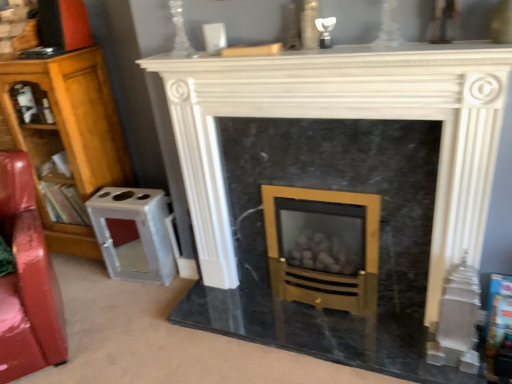
Question: Can you confirm if glossy red swivel chair at left is positioned to the left of wooden bookcase at left?

Choices:
 (A) no
 (B) yes

Answer: (A)

Question: Does glossy red swivel chair at left contain wooden bookcase at left?

Choices:
 (A) yes
 (B) no

Answer: (B)

Question: Does glossy red swivel chair at left have a lesser height compared to wooden bookcase at left?

Choices:
 (A) no
 (B) yes

Answer: (B)

Question: Could you tell me if glossy red swivel chair at left is turned towards wooden bookcase at left?

Choices:
 (A) yes
 (B) no

Answer: (B)

Question: From the image's perspective, is glossy red swivel chair at left below wooden bookcase at left?

Choices:
 (A) no
 (B) yes

Answer: (B)

Question: Is glossy red swivel chair at left thinner than wooden bookcase at left?

Choices:
 (A) yes
 (B) no

Answer: (B)

Question: Is wooden bookcase at left positioned with its back to white marble fireplace at center?

Choices:
 (A) yes
 (B) no

Answer: (B)

Question: From the image's perspective, is wooden bookcase at left located beneath white marble fireplace at center?

Choices:
 (A) no
 (B) yes

Answer: (A)

Question: Is wooden bookcase at left positioned behind white marble fireplace at center?

Choices:
 (A) yes
 (B) no

Answer: (A)

Question: Is wooden bookcase at left wider than white marble fireplace at center?

Choices:
 (A) no
 (B) yes

Answer: (B)

Question: Considering the relative sizes of wooden bookcase at left and white marble fireplace at center in the image provided, is wooden bookcase at left thinner than white marble fireplace at center?

Choices:
 (A) yes
 (B) no

Answer: (B)

Question: Is white marble fireplace at center a part of wooden bookcase at left?

Choices:
 (A) yes
 (B) no

Answer: (B)

Question: Is glossy red swivel chair at left smaller than white marble fireplace at center?

Choices:
 (A) no
 (B) yes

Answer: (B)